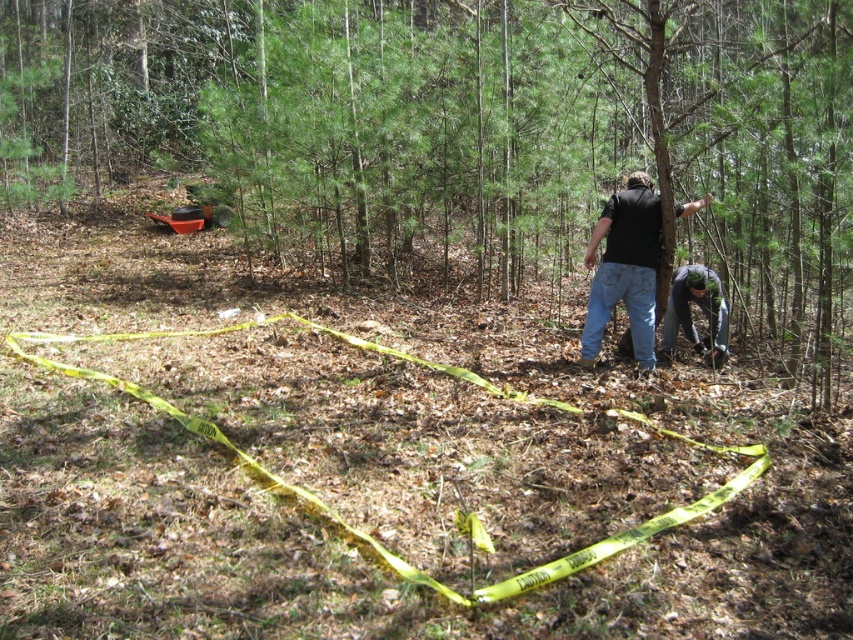
Consider the image. You are a park ranger assessing a restricted area marked by a caution tape. You notice a green textured tree at center and a black matte shirt at center. Which object is taller?

The green textured tree at center is taller than the black matte shirt at center.

You are standing in the wooded area and see the bright yellow caution tape stretched across the scene. There is also a point marked at coordinates (466, 131). What object is located at that point?

The point at (466, 131) corresponds to a green textured tree at center.